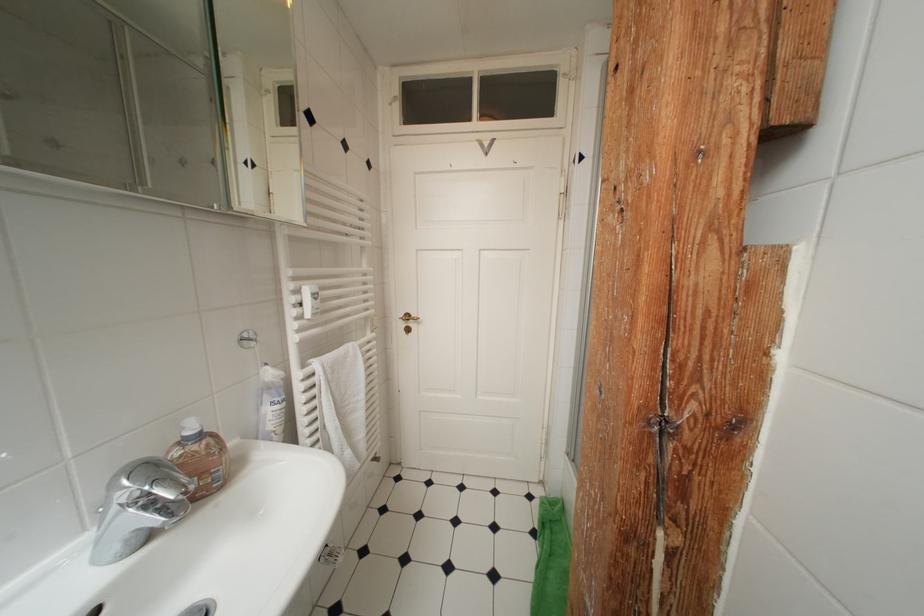
Locate an element on the screen. This screenshot has height=616, width=924. chrome faucet handle is located at coordinates (134, 522).